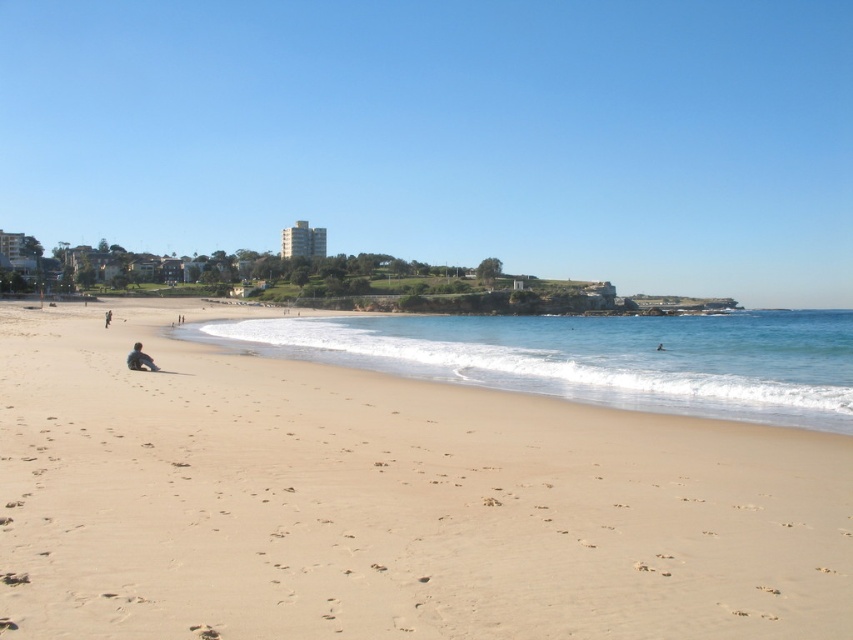
You are standing on the beach and notice both the light brown sand at lower left and the dark blue jeans at lower left. Which object is positioned more to the left side?

The light brown sand at lower left is positioned to the left of the dark blue jeans at lower left.

You are standing at the point with coordinates point [106,314] and want to walk to the point with coordinates point [550,385]. Which direction should you move to reach your destination?

You should move forward because point [550,385] is in front of point [106,314].

You are standing on the beach and see the light brown sand at center and the dark blue jeans at lower left. Which object is closer to the right side of the beach?

The light brown sand at center is to the right of dark blue jeans at lower left, so the light brown sand at center is closer to the right side of the beach.